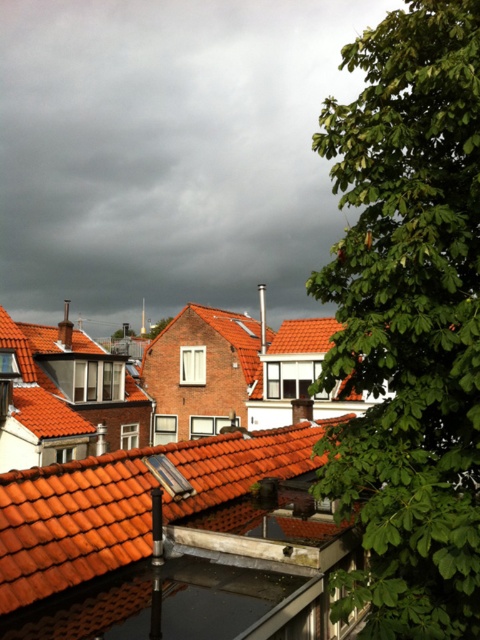
Who is lower down, green leafy tree at right or orange clay tiles at center?

orange clay tiles at center

Based on the photo, which is above, green leafy tree at right or orange clay tiles at center?

green leafy tree at right is above.

Locate an element on the screen. The height and width of the screenshot is (640, 480). green leafy tree at right is located at coordinates (408, 320).

Where is `green leafy tree at right`? The image size is (480, 640). green leafy tree at right is located at coordinates (408, 320).

Who is taller, green leafy tree at right or green leafy tree at center?

With more height is green leafy tree at right.

Who is more forward, (x=475, y=93) or (x=148, y=330)?

Point (x=475, y=93) is in front.

Identify the location of green leafy tree at right. This screenshot has width=480, height=640. (408, 320).

Can you confirm if orange clay tiles at center is taller than green leafy tree at center?

Incorrect, orange clay tiles at center's height is not larger of green leafy tree at center's.

Looking at this image, between orange clay tiles at center and green leafy tree at center, which one appears on the left side from the viewer's perspective?

Positioned to the left is green leafy tree at center.

Is point (58, 532) farther from viewer compared to point (165, 317)?

No, it is in front of (165, 317).

The image size is (480, 640). I want to click on orange clay tiles at center, so click(128, 502).